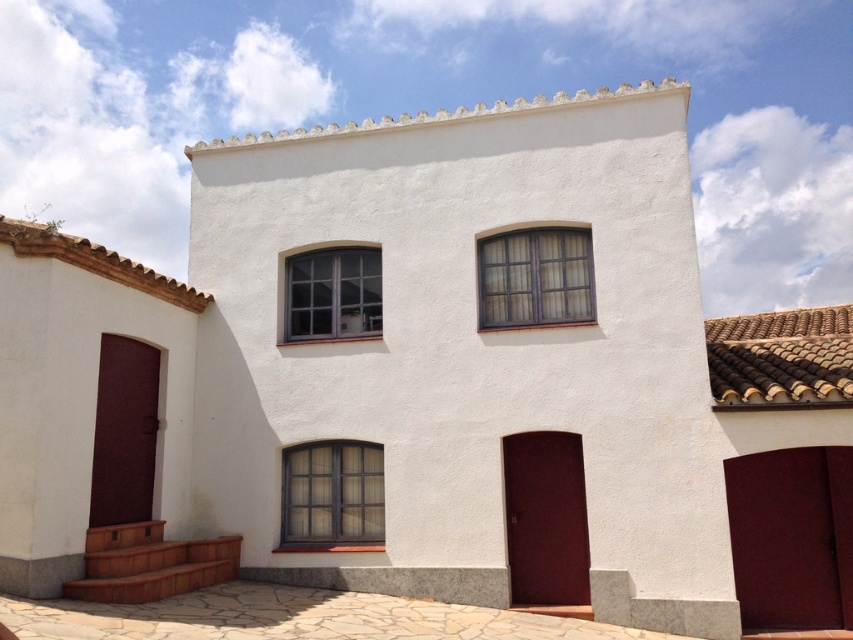
Who is more distant from viewer, (846, 305) or (287, 336)?

The point (846, 305) is behind.

Who is shorter, brown clay tiles at upper right or matte gray window at center?

With less height is brown clay tiles at upper right.

Between point (820, 362) and point (345, 298), which one is positioned in front?

Point (820, 362)

Where is `brown clay tiles at upper right`? This screenshot has width=853, height=640. brown clay tiles at upper right is located at coordinates (781, 356).

Is brown clay tiles at upper right to the right of matte glass window at center from the viewer's perspective?

Indeed, brown clay tiles at upper right is positioned on the right side of matte glass window at center.

Where is `brown clay tiles at upper right`? The image size is (853, 640). brown clay tiles at upper right is located at coordinates (781, 356).

Where is `brown clay tiles at upper right`? This screenshot has height=640, width=853. brown clay tiles at upper right is located at coordinates (781, 356).

Which is in front, point (769, 400) or point (567, 246)?

Positioned in front is point (769, 400).

Which is behind, point (838, 333) or point (489, 300)?

The point (838, 333) is behind.

Is point (816, 380) in front of point (573, 296)?

Yes.

You are a GUI agent. You are given a task and a screenshot of the screen. Output one action in this format:
    pyautogui.click(x=<x>, y=<y>)
    Task: Click on the brown clay tiles at upper right
    This screenshot has height=640, width=853.
    Given the screenshot: What is the action you would take?
    pyautogui.click(x=781, y=356)